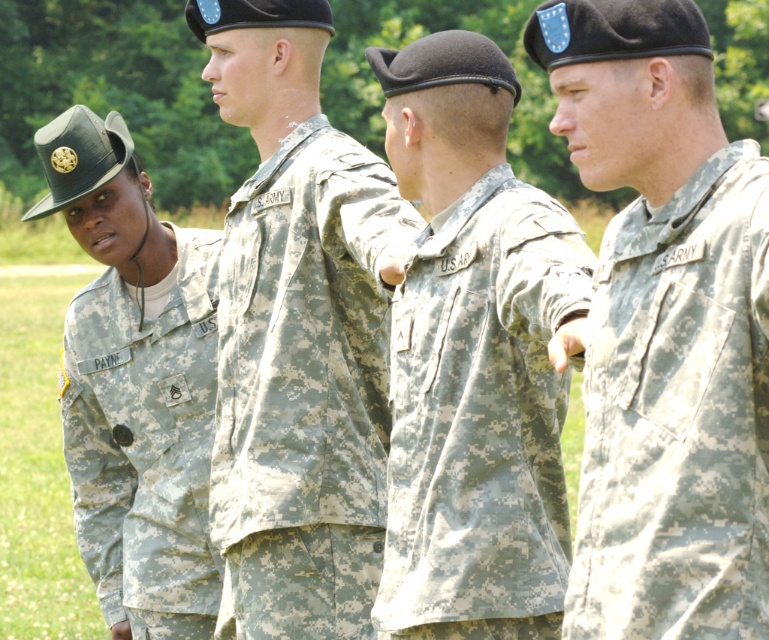
You are a photographer standing in front of the group of U.S. Army personnel. You want to take a closeup photo of the camouflage fabric uniform at right. Considering your current position, can you estimate how far you need to move forward to get the uniform within the camera frame?

The camouflage fabric uniform at right is 6.57 meters away from the viewer. To capture it in a closeup, you would need to move closer, but the exact distance adjustment depends on your camera lens and desired framing. However, the uniform is currently 6.57 meters away.

You are a photographer trying to capture a clear image of the camouflage fabric uniform at right and the camouflage fabric at center. Which one would appear larger in your photo if you focus on the center of the image?

The camouflage fabric at center would appear larger in the photo because it is larger than the camouflage fabric uniform at right.